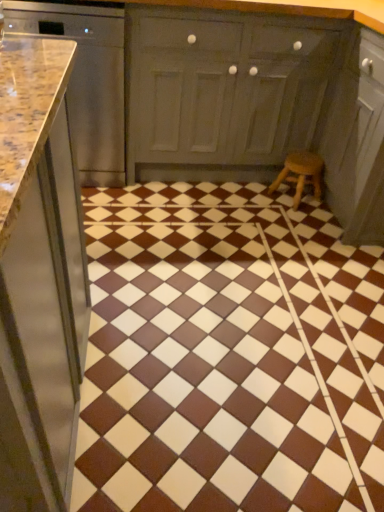
You are a GUI agent. You are given a task and a screenshot of the screen. Output one action in this format:
    pyautogui.click(x=<x>, y=<y>)
    Task: Click on the free region under wooden stool at lower right (from a real-world perspective)
    
    Given the screenshot: What is the action you would take?
    pyautogui.click(x=300, y=199)